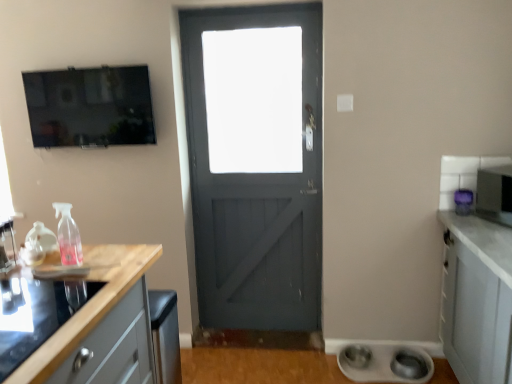
Describe the element at coordinates (68, 236) in the screenshot. I see `pink translucent spray bottle at left` at that location.

Describe the element at coordinates (463, 201) in the screenshot. The image size is (512, 384). I see `purple plastic microwave at right, the second appliance when ordered from top to bottom` at that location.

Find the location of a particular element. The image size is (512, 384). white matte bowls at lower right, which is the first appliance from bottom to top is located at coordinates (385, 364).

Find the location of a particular element. This screenshot has width=512, height=384. window screen located behind the pink translucent spray bottle at left is located at coordinates (90, 107).

From a real-world perspective, is matte black tv at upper left positioned above or below pink translucent spray bottle at left?

matte black tv at upper left is situated higher than pink translucent spray bottle at left in the real world.

Considering the relative sizes of matte black tv at upper left and pink translucent spray bottle at left in the image provided, is matte black tv at upper left shorter than pink translucent spray bottle at left?

No, matte black tv at upper left is not shorter than pink translucent spray bottle at left.

Is the depth of matte black tv at upper left greater than that of pink translucent spray bottle at left?

Yes, matte black tv at upper left is further from the camera.

Is pink translucent spray bottle at left with metallic silver microwave at right, which appears as the 1th appliance when viewed from the right?

pink translucent spray bottle at left and metallic silver microwave at right, which appears as the 1th appliance when viewed from the right, are not in contact.

Is pink translucent spray bottle at left at the left side of metallic silver microwave at right, the third appliance in the bottom-to-top sequence?

Indeed, pink translucent spray bottle at left is positioned on the left side of metallic silver microwave at right, the third appliance in the bottom-to-top sequence.

Is pink translucent spray bottle at left oriented towards metallic silver microwave at right, which appears as the 1th appliance when viewed from the top?

No.

How distant is pink translucent spray bottle at left from metallic silver microwave at right, which appears as the 3th appliance when viewed from the left?

The distance of pink translucent spray bottle at left from metallic silver microwave at right, which appears as the 3th appliance when viewed from the left, is 6.74 feet.

In terms of height, does metallic silver microwave at right, the third appliance in the bottom-to-top sequence, look taller or shorter compared to matte black tv at upper left?

In the image, metallic silver microwave at right, the third appliance in the bottom-to-top sequence, appears to be shorter than matte black tv at upper left.

Is point (484, 202) closer or farther from the camera than point (115, 103)?

Point (484, 202) appears to be closer to the viewer than point (115, 103).

How different are the orientations of metallic silver microwave at right, the third appliance in the bottom-to-top sequence, and matte black tv at upper left in degrees?

65.1 degrees.

Considering the sizes of metallic silver microwave at right, the third appliance in the bottom-to-top sequence, and matte black tv at upper left in the image, is metallic silver microwave at right, the third appliance in the bottom-to-top sequence, bigger or smaller than matte black tv at upper left?

Considering their sizes, metallic silver microwave at right, the third appliance in the bottom-to-top sequence, takes up less space than matte black tv at upper left.

From the image's perspective, which object appears higher, purple plastic microwave at right, the 2th appliance positioned from the left, or matte black tv at upper left?

matte black tv at upper left.

Is purple plastic microwave at right, the 2th appliance positioned from the left, positioned with its back to matte black tv at upper left?

That's not correct — purple plastic microwave at right, the 2th appliance positioned from the left, is not looking away from matte black tv at upper left.

Considering the positions of points (462, 199) and (118, 87), is point (462, 199) farther from camera compared to point (118, 87)?

That is False.

You are a GUI agent. You are given a task and a screenshot of the screen. Output one action in this format:
    pyautogui.click(x=<x>, y=<y>)
    Task: Click on the window screen that appears above the purple plastic microwave at right, which is the 2th appliance in right-to-left order (from a real-world perspective)
    This screenshot has height=384, width=512.
    Given the screenshot: What is the action you would take?
    pyautogui.click(x=90, y=107)

How distant is white matte bowls at lower right, which is the first appliance from bottom to top, from matte black tv at upper left?

white matte bowls at lower right, which is the first appliance from bottom to top, and matte black tv at upper left are 1.98 meters apart from each other.

From a real-world perspective, which is physically below, white matte bowls at lower right, which is the first appliance from bottom to top, or matte black tv at upper left?

In real-world perspective, white matte bowls at lower right, which is the first appliance from bottom to top, is lower.

Is white matte bowls at lower right, the 3th appliance viewed from the right, in front of or behind matte black tv at upper left in the image?

white matte bowls at lower right, the 3th appliance viewed from the right, is behind matte black tv at upper left.

From the image's perspective, between white matte bowls at lower right, the 3th appliance viewed from the right, and matte black tv at upper left, which one is located above?

matte black tv at upper left, from the image's perspective.

Based on the photo, does wooden at left come in front of white matte bowls at lower right, which is the first appliance from bottom to top?

Yes, it is in front of white matte bowls at lower right, which is the first appliance from bottom to top.

Is wooden at left placed right next to white matte bowls at lower right, positioned as the 1th appliance in left-to-right order?

There is a gap between wooden at left and white matte bowls at lower right, positioned as the 1th appliance in left-to-right order.

This screenshot has height=384, width=512. I want to click on the 1st appliance counting from the right side of the wooden at left, so click(385, 364).

Considering the points (41, 307) and (419, 368), which point is in front, point (41, 307) or point (419, 368)?

The point (41, 307) is more forward.

In the scene shown: Does metallic silver microwave at right, which appears as the 1th appliance when viewed from the right, turn towards white matte bowls at lower right, the 3th appliance viewed from the right?

No, metallic silver microwave at right, which appears as the 1th appliance when viewed from the right, is not aimed at white matte bowls at lower right, the 3th appliance viewed from the right.

Who is taller, metallic silver microwave at right, which appears as the 1th appliance when viewed from the right, or white matte bowls at lower right, which appears as the 3th appliance when viewed from the top?

metallic silver microwave at right, which appears as the 1th appliance when viewed from the right.

Does metallic silver microwave at right, which appears as the 3th appliance when viewed from the left, appear on the left side of white matte bowls at lower right, which appears as the 3th appliance when viewed from the top?

No, metallic silver microwave at right, which appears as the 3th appliance when viewed from the left, is not to the left of white matte bowls at lower right, which appears as the 3th appliance when viewed from the top.

Is metallic silver microwave at right, which appears as the 1th appliance when viewed from the right, outside of white matte bowls at lower right, which is the first appliance from bottom to top?

Yes, metallic silver microwave at right, which appears as the 1th appliance when viewed from the right, is located beyond the bounds of white matte bowls at lower right, which is the first appliance from bottom to top.

This screenshot has height=384, width=512. In order to click on bottle that is under the matte black tv at upper left (from a real-world perspective) in this screenshot , I will do (x=68, y=236).

Locate an element on the screen. This screenshot has height=384, width=512. bottle located above the metallic silver microwave at right, which appears as the 1th appliance when viewed from the top (from a real-world perspective) is located at coordinates (68, 236).

Looking at the image, which one is located closer to metallic silver microwave at right, which appears as the 1th appliance when viewed from the top, matte black tv at upper left or pink translucent spray bottle at left?

pink translucent spray bottle at left is positioned closer to the anchor metallic silver microwave at right, which appears as the 1th appliance when viewed from the top.

Which object lies further to the anchor point white matte bowls at lower right, the 3th appliance viewed from the right, metallic silver microwave at right, which appears as the 3th appliance when viewed from the left, or pink translucent spray bottle at left?

The object further to white matte bowls at lower right, the 3th appliance viewed from the right, is pink translucent spray bottle at left.

Looking at this image, when comparing their distances from wooden at left, does metallic silver microwave at right, the third appliance in the bottom-to-top sequence, or white matte bowls at lower right, positioned as the 1th appliance in left-to-right order, seem closer?

white matte bowls at lower right, positioned as the 1th appliance in left-to-right order, is closer to wooden at left.

Looking at the image, which one is located further to white matte bowls at lower right, the 3th appliance viewed from the right, pink translucent spray bottle at left or wooden at left?

pink translucent spray bottle at left.

In the scene shown: Considering their positions, is matte black tv at upper left positioned closer to white matte bowls at lower right, the 3th appliance viewed from the right, than pink translucent spray bottle at left?

Among the two, pink translucent spray bottle at left is located nearer to white matte bowls at lower right, the 3th appliance viewed from the right.

From the image, which object appears to be farther from metallic silver microwave at right, which appears as the 1th appliance when viewed from the top, pink translucent spray bottle at left or purple plastic microwave at right, which is the 2th appliance in right-to-left order?

pink translucent spray bottle at left lies further to metallic silver microwave at right, which appears as the 1th appliance when viewed from the top, than the other object.

Looking at this image, from the image, which object appears to be nearer to purple plastic microwave at right, which is the 2th appliance in right-to-left order, pink translucent spray bottle at left or white matte bowls at lower right, which appears as the 3th appliance when viewed from the top?

Based on the image, white matte bowls at lower right, which appears as the 3th appliance when viewed from the top, appears to be nearer to purple plastic microwave at right, which is the 2th appliance in right-to-left order.

Which object lies nearer to the anchor point purple plastic microwave at right, which is the 2th appliance in right-to-left order, wooden at left or metallic silver microwave at right, which appears as the 3th appliance when viewed from the left?

Among the two, metallic silver microwave at right, which appears as the 3th appliance when viewed from the left, is located nearer to purple plastic microwave at right, which is the 2th appliance in right-to-left order.

At what (x,y) coordinates should I click in order to perform the action: click on appliance located between matte black tv at upper left and purple plastic microwave at right, which is the 2th appliance in right-to-left order, in the left-right direction. Please return your answer as a coordinate pair (x, y). The height and width of the screenshot is (384, 512). Looking at the image, I should click on (385, 364).

Where is `countertop between matte black tv at upper left and metallic silver microwave at right, which appears as the 1th appliance when viewed from the right, in the horizontal direction`? Image resolution: width=512 pixels, height=384 pixels. countertop between matte black tv at upper left and metallic silver microwave at right, which appears as the 1th appliance when viewed from the right, in the horizontal direction is located at coordinates [x=80, y=320].

Locate an element on the screen. appliance between metallic silver microwave at right, which appears as the 1th appliance when viewed from the right, and white matte bowls at lower right, the 3th appliance viewed from the right, from top to bottom is located at coordinates coord(463,201).

This screenshot has height=384, width=512. Find the location of `bottle situated between matte black tv at upper left and metallic silver microwave at right, the third appliance in the bottom-to-top sequence, from left to right`. bottle situated between matte black tv at upper left and metallic silver microwave at right, the third appliance in the bottom-to-top sequence, from left to right is located at coordinates (68, 236).